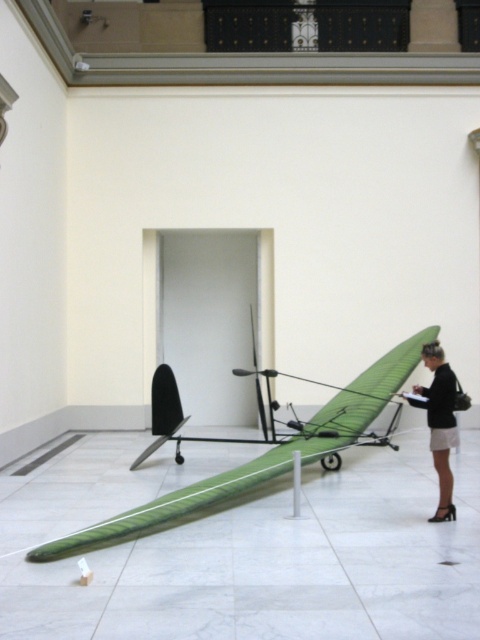
You are an interior designer planning to place a new sculpture in this gallery. The sculpture is 1 meter wide. You want to ensure it doesn not block the view of the green fabric plane at center and the black leather skirt at lower right. Given their widths, can you place the sculpture between them without overlapping?

The green fabric plane at center is thinner than the black leather skirt at lower right. Since the sculpture is 1 meter wide, you need to check the space between them. However, the exact distance between the two objects isn not provided, so it is uncertain if the sculpture can fit without overlapping. More information about the spacing between the green fabric plane at center and the black leather skirt at lower right is needed.

You are an art curator planning to rearrange the exhibition space. You need to move the green fabric plane at center and the black leather skirt at lower right to different locations. Based on their current positions, which object is closer to the floor?

The green fabric plane at center is closer to the floor since it is positioned below the black leather skirt at lower right.

You are an interior designer planning to hang a large painting above the green fabric plane at center. Considering the height of the black leather skirt at lower right, do you think the painting will be visible from the floor level?

The green fabric plane at center is not as tall as the black leather skirt at lower right, so the painting hung above the green fabric plane at center may still be visible from the floor level since it is shorter than the skirt.